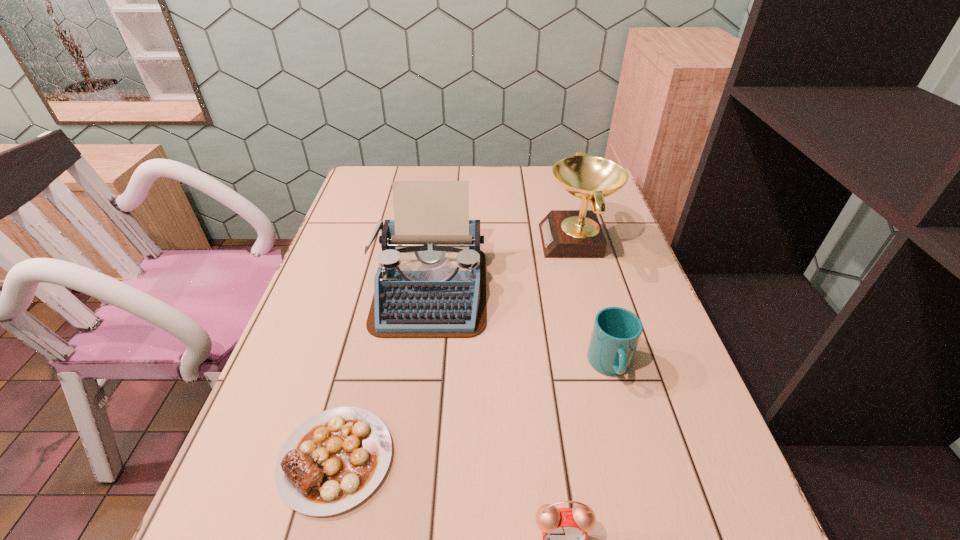
In order to click on blank region between the cup and the award in this screenshot , I will do `click(593, 303)`.

Identify the location of vacant area that lies between the typewriter and the third nearest object. (519, 327).

Where is `free point between the award and the typewriter`? free point between the award and the typewriter is located at coordinates (503, 265).

Identify which object is located as the fourth nearest to the third object from right to left. Please provide its 2D coordinates. Your answer should be formatted as a tuple, i.e. [(x, y)], where the tuple contains the x and y coordinates of a point satisfying the conditions above.

[(564, 233)]

Find the location of a particular element. Image resolution: width=960 pixels, height=540 pixels. the second closest object to the shortest object is located at coordinates (564, 530).

Find the location of a particular element. This screenshot has height=540, width=960. free spot that satisfies the following two spatial constraints: 1. on the front-facing side of the award; 2. on the typing side of the typewriter is located at coordinates (589, 288).

The width and height of the screenshot is (960, 540). In order to click on free spot that satisfies the following two spatial constraints: 1. on the front-facing side of the award; 2. on the handle side of the third nearest object in this screenshot , I will do pos(611,366).